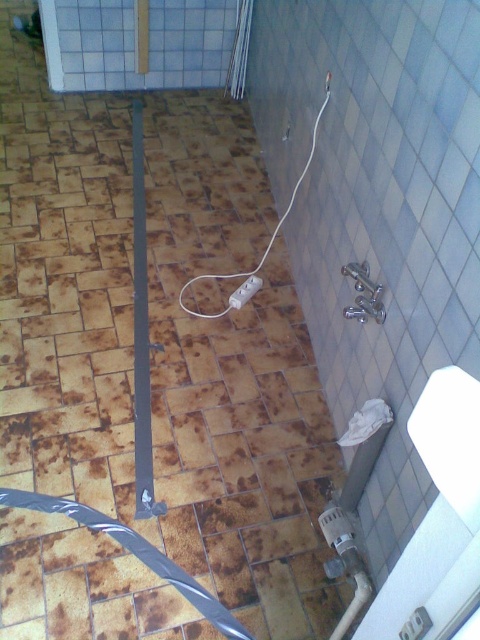
Which is in front, point (348, 429) or point (235, 304)?

Point (348, 429) is more forward.

Find the location of a particular element. The width and height of the screenshot is (480, 640). white matte toilet paper at lower right is located at coordinates (365, 422).

Between point (372, 420) and point (243, 294), which one is positioned behind?

Positioned behind is point (243, 294).

Where is `white matte toilet paper at lower right`? The width and height of the screenshot is (480, 640). white matte toilet paper at lower right is located at coordinates 365,422.